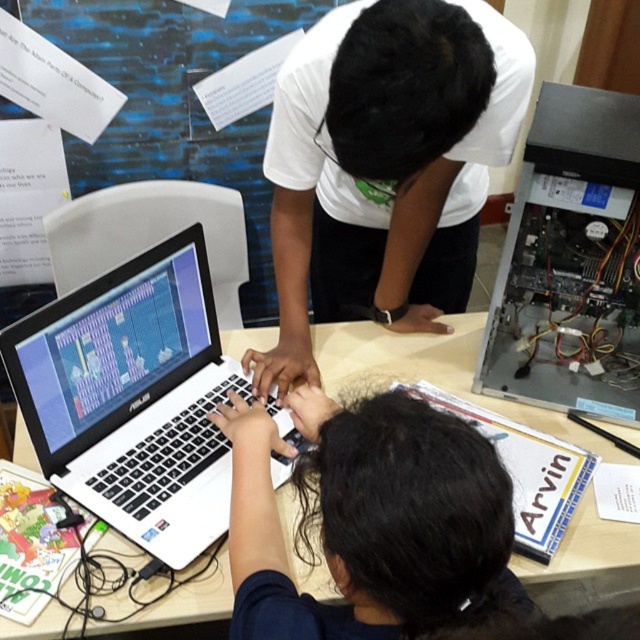
Question: Is black matte laptop at center positioned at the back of blue paper at upper left?

Choices:
 (A) no
 (B) yes

Answer: (A)

Question: In this image, where is silver metallic computer case at right located relative to white matte table at center?

Choices:
 (A) right
 (B) left

Answer: (A)

Question: Among these points, which one is farthest from the camera?

Choices:
 (A) (532, 368)
 (B) (156, 369)
 (C) (24, 460)

Answer: (A)

Question: Which point is farther from the camera taking this photo?

Choices:
 (A) (426, 349)
 (B) (134, 314)

Answer: (A)

Question: Does blue paper at upper left appear over white matte table at center?

Choices:
 (A) yes
 (B) no

Answer: (A)

Question: Which point appears closest to the camera in this image?

Choices:
 (A) (634, 216)
 (B) (81, 156)
 (C) (634, 442)

Answer: (A)